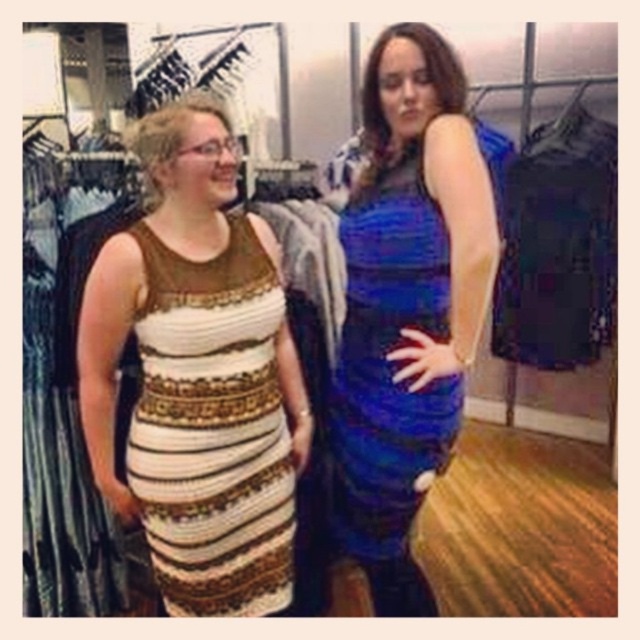
The image size is (640, 640). What do you see at coordinates (406, 305) in the screenshot?
I see `shiny blue dress at center` at bounding box center [406, 305].

Who is more forward, (332, 404) or (172, 499)?

Point (172, 499)

Find the location of a particular element. This screenshot has width=640, height=640. shiny blue dress at center is located at coordinates (406, 305).